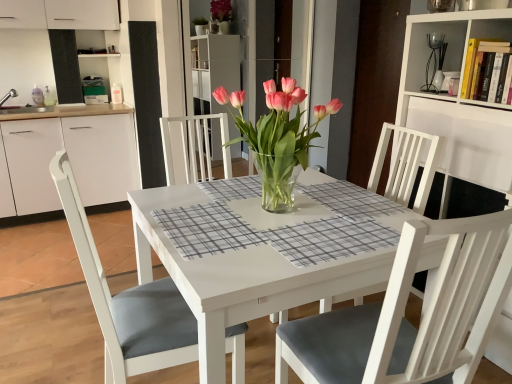
Identify the location of empty space that is ontop of white glossy table at center (from a real-world perspective). Image resolution: width=512 pixels, height=384 pixels. (278, 214).